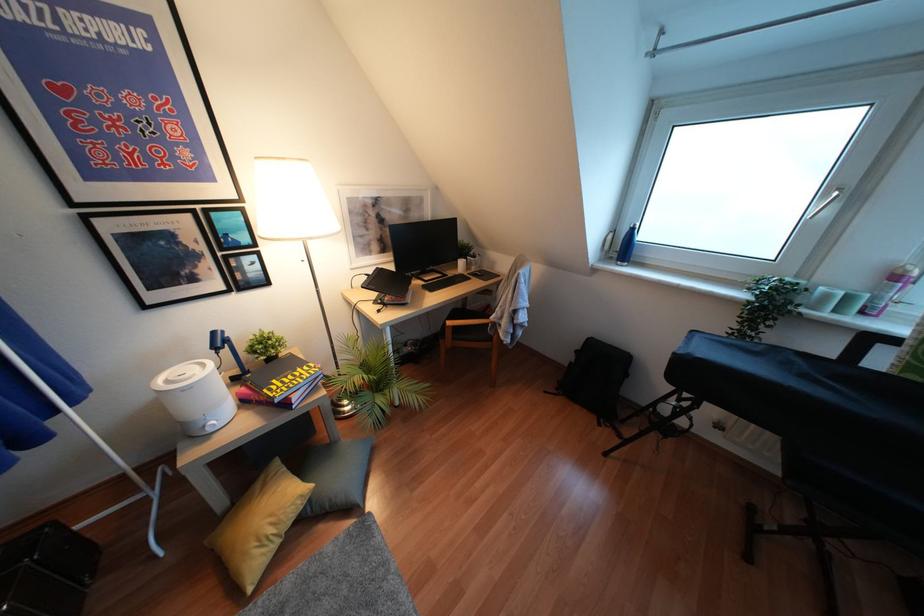
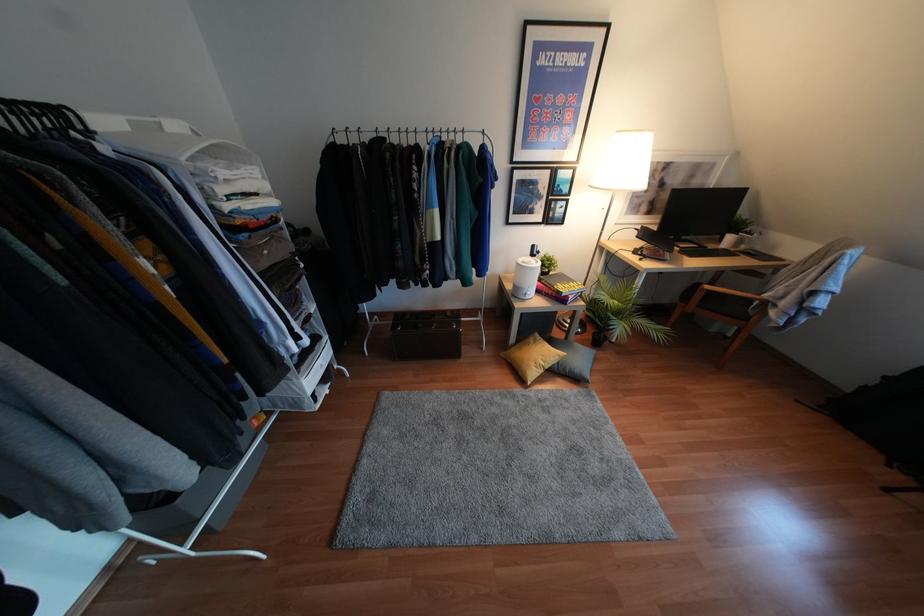
Find the pixel in the second image that matches [210,430] in the first image.

(526, 297)